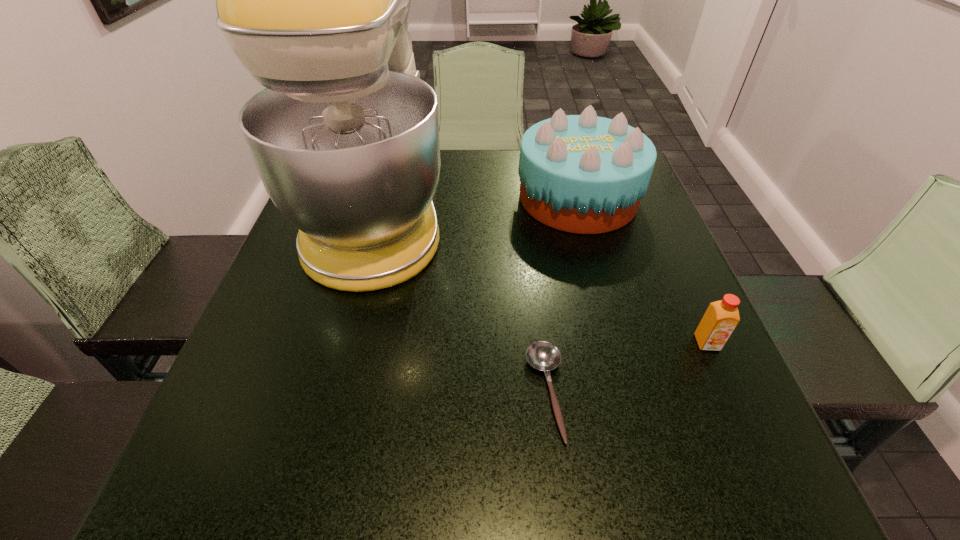
Identify the location of cake present at the far edge. This screenshot has width=960, height=540. (584, 174).

Locate an element on the screen. This screenshot has height=540, width=960. object at the near edge is located at coordinates (544, 356).

Identify the location of object positioned at the left edge. (313, 0).

This screenshot has height=540, width=960. In order to click on cake that is at the right edge in this screenshot , I will do tap(584, 174).

Where is `orange juice located in the right edge section of the desktop`? orange juice located in the right edge section of the desktop is located at coordinates (721, 318).

I want to click on object situated at the far left corner, so click(313, 0).

Find the location of a particular element. object that is at the far right corner is located at coordinates (584, 174).

At what (x,y) coordinates should I click in order to perform the action: click on vacant space at the far edge. Please return your answer as a coordinate pair (x, y). Looking at the image, I should click on (484, 186).

This screenshot has width=960, height=540. In the image, there is a desktop. In order to click on vacant space at the near edge in this screenshot , I will do `click(499, 496)`.

In the image, there is a desktop. Identify the location of free space at the left edge. (297, 257).